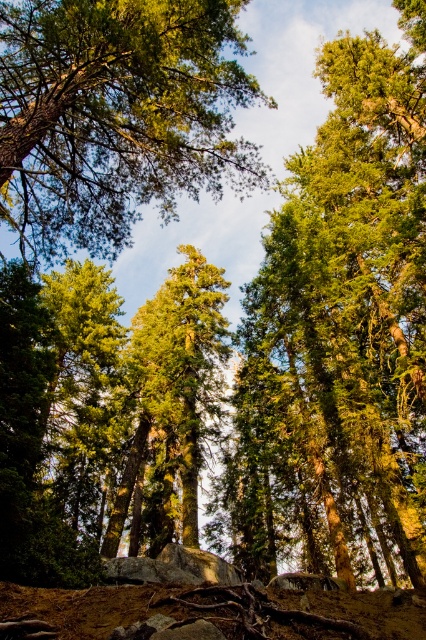
Question: Is green textured tree at center above green rough bark tree at upper center?

Choices:
 (A) no
 (B) yes

Answer: (A)

Question: Considering the relative positions of green textured tree at center and green rough bark tree at upper center in the image provided, where is green textured tree at center located with respect to green rough bark tree at upper center?

Choices:
 (A) left
 (B) right

Answer: (B)

Question: Is green textured tree at center thinner than green rough bark tree at upper center?

Choices:
 (A) no
 (B) yes

Answer: (B)

Question: Which of the following is the farthest from the observer?

Choices:
 (A) (227, 35)
 (B) (276, 500)

Answer: (B)

Question: Which object appears closest to the camera in this image?

Choices:
 (A) green rough bark tree at upper center
 (B) green textured tree at center

Answer: (A)